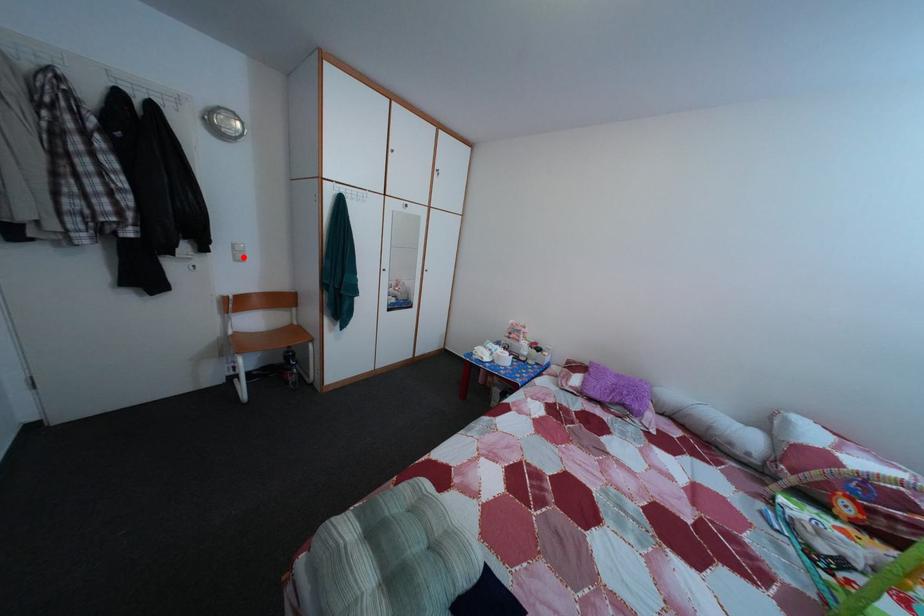
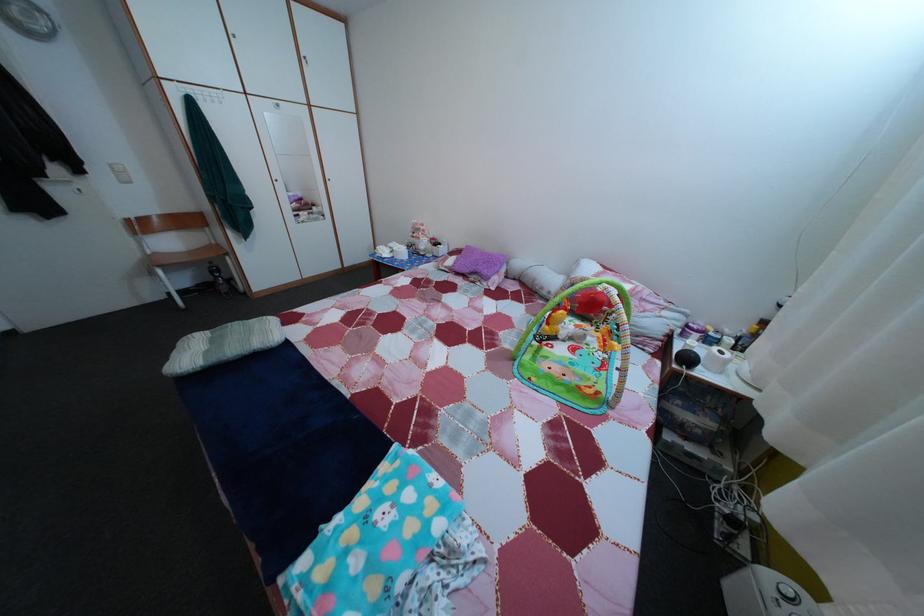
The point at the highlighted location is marked in the first image. Where is the corresponding point in the second image?

(123, 177)